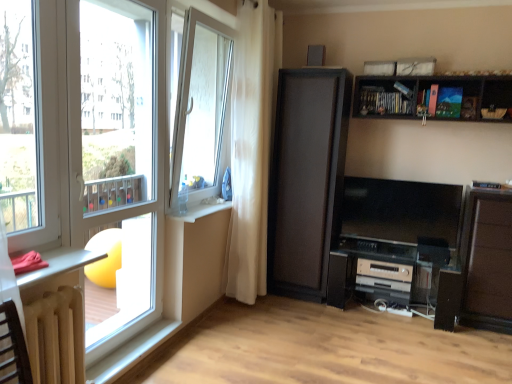
Question: Is metallic silver table at lower left, positioned as the 1th table in top-to-bottom order, bigger than wooden dark brown shelf at upper right?

Choices:
 (A) no
 (B) yes

Answer: (A)

Question: Does metallic silver table at lower left, positioned as the 1th table in top-to-bottom order, turn towards wooden dark brown shelf at upper right?

Choices:
 (A) yes
 (B) no

Answer: (B)

Question: Is metallic silver table at lower left, positioned as the second table in bottom-to-top order, located outside wooden dark brown shelf at upper right?

Choices:
 (A) yes
 (B) no

Answer: (A)

Question: Considering the relative positions of metallic silver table at lower left, positioned as the 1th table in top-to-bottom order, and wooden dark brown shelf at upper right in the image provided, is metallic silver table at lower left, positioned as the 1th table in top-to-bottom order, in front of wooden dark brown shelf at upper right?

Choices:
 (A) no
 (B) yes

Answer: (B)

Question: Does metallic silver table at lower left, positioned as the 1th table in top-to-bottom order, have a lesser width compared to wooden dark brown shelf at upper right?

Choices:
 (A) yes
 (B) no

Answer: (B)

Question: Is white sheer curtain at center to the left or to the right of silver metallic stereo at lower center, which ranks as the first appliance in bottom-to-top order, in the image?

Choices:
 (A) left
 (B) right

Answer: (A)

Question: Looking at their shapes, would you say white sheer curtain at center is wider or thinner than silver metallic stereo at lower center, which ranks as the first appliance in bottom-to-top order?

Choices:
 (A) thin
 (B) wide

Answer: (A)

Question: From a real-world perspective, is white sheer curtain at center positioned above or below silver metallic stereo at lower center, which ranks as the first appliance in bottom-to-top order?

Choices:
 (A) below
 (B) above

Answer: (B)

Question: Which is correct: white sheer curtain at center is inside silver metallic stereo at lower center, which ranks as the first appliance in bottom-to-top order, or outside of it?

Choices:
 (A) inside
 (B) outside

Answer: (B)

Question: Is white plastic window sill at lower left taller or shorter than white glass window at center, the 2th window from the front?

Choices:
 (A) tall
 (B) short

Answer: (B)

Question: Is white plastic window sill at lower left inside the boundaries of white glass window at center, the 2th window from the front, or outside?

Choices:
 (A) outside
 (B) inside

Answer: (A)

Question: In the image, is white plastic window sill at lower left on the left side or the right side of white glass window at center, marked as the first window in a back-to-front arrangement?

Choices:
 (A) right
 (B) left

Answer: (A)

Question: Relative to white glass window at center, the 2th window from the front, is white plastic window sill at lower left in front or behind?

Choices:
 (A) front
 (B) behind

Answer: (B)

Question: Considering the positions of silver metallic stereo at lower center, the 2th appliance when ordered from top to bottom, and white plastic window sill at lower left in the image, is silver metallic stereo at lower center, the 2th appliance when ordered from top to bottom, wider or thinner than white plastic window sill at lower left?

Choices:
 (A) thin
 (B) wide

Answer: (B)

Question: Is silver metallic stereo at lower center, the 2th appliance when ordered from top to bottom, in front of or behind white plastic window sill at lower left in the image?

Choices:
 (A) behind
 (B) front

Answer: (A)